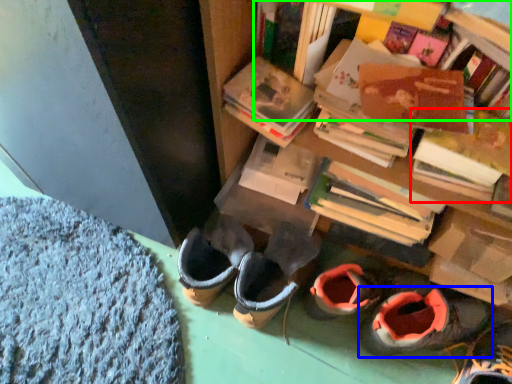
Question: Estimate the real-world distances between objects in this image. Which object is closer to book (highlighted by a red box), footwear (highlighted by a blue box) or shelf (highlighted by a green box)?

Choices:
 (A) footwear
 (B) shelf

Answer: (B)